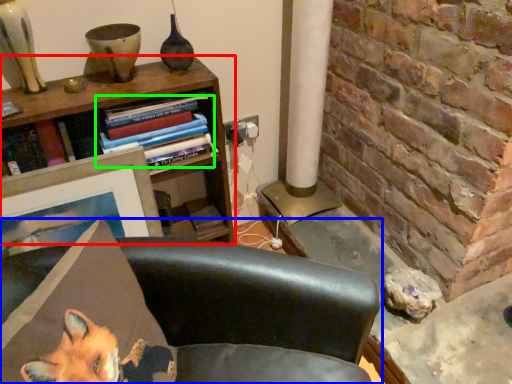
Question: Which object is the farthest from bookcase (highlighted by a red box)? Choose among these: chair (highlighted by a blue box) or book (highlighted by a green box).

Choices:
 (A) chair
 (B) book

Answer: (A)